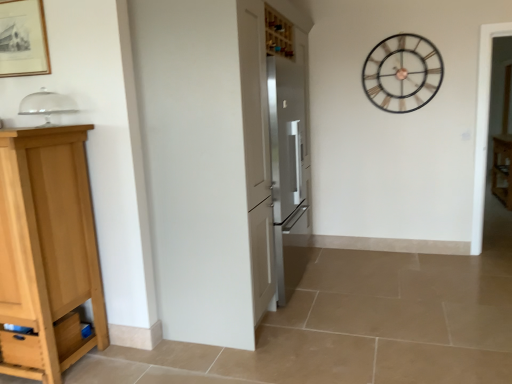
Question: Could you tell me if satin silver refrigerator at center, positioned as the first appliance in bottom-to-top order, is facing metallic gold clock at upper right?

Choices:
 (A) no
 (B) yes

Answer: (A)

Question: Are satin silver refrigerator at center, which is the second appliance from top to bottom, and metallic gold clock at upper right located far from each other?

Choices:
 (A) yes
 (B) no

Answer: (A)

Question: From the image's perspective, would you say satin silver refrigerator at center, positioned as the first appliance in bottom-to-top order, is positioned over metallic gold clock at upper right?

Choices:
 (A) no
 (B) yes

Answer: (A)

Question: Is metallic gold clock at upper right surrounded by satin silver refrigerator at center, acting as the 1th appliance starting from the back?

Choices:
 (A) yes
 (B) no

Answer: (B)

Question: Is satin silver refrigerator at center, which is the second appliance from top to bottom, positioned with its back to metallic gold clock at upper right?

Choices:
 (A) no
 (B) yes

Answer: (A)

Question: Looking at their shapes, would you say wooden cabinet at right, placed as the first cabinetry when sorted from back to front, is wider or thinner than satin silver refrigerator at center, positioned as the first appliance in bottom-to-top order?

Choices:
 (A) wide
 (B) thin

Answer: (B)

Question: From a real-world perspective, is wooden cabinet at right, the first cabinetry when ordered from right to left, positioned above or below satin silver refrigerator at center, the 1th appliance from the right?

Choices:
 (A) above
 (B) below

Answer: (B)

Question: Is wooden cabinet at right, which is the 2th cabinetry in front-to-back order, taller or shorter than satin silver refrigerator at center, the second appliance in the left-to-right sequence?

Choices:
 (A) short
 (B) tall

Answer: (A)

Question: Is wooden cabinet at right, which ranks as the 2th cabinetry in left-to-right order, in front of or behind satin silver refrigerator at center, acting as the 1th appliance starting from the back, in the image?

Choices:
 (A) behind
 (B) front

Answer: (A)

Question: Is wooden picture frame at upper left spatially inside light wood cabinet at left, the second cabinetry when ordered from back to front, or outside of it?

Choices:
 (A) outside
 (B) inside

Answer: (A)

Question: Considering the positions of point pos(11,11) and point pos(2,339), is point pos(11,11) closer or farther from the camera than point pos(2,339)?

Choices:
 (A) farther
 (B) closer

Answer: (A)

Question: Based on their sizes in the image, would you say wooden picture frame at upper left is bigger or smaller than light wood cabinet at left, the first cabinetry in the left-to-right sequence?

Choices:
 (A) small
 (B) big

Answer: (A)

Question: Relative to light wood cabinet at left, the first cabinetry in the left-to-right sequence, is wooden picture frame at upper left in front or behind?

Choices:
 (A) front
 (B) behind

Answer: (B)

Question: Looking at their shapes, would you say wooden cabinet at right, placed as the first cabinetry when sorted from back to front, is wider or thinner than wooden picture frame at upper left?

Choices:
 (A) wide
 (B) thin

Answer: (A)

Question: Does point (503, 190) appear closer or farther from the camera than point (22, 29)?

Choices:
 (A) farther
 (B) closer

Answer: (A)